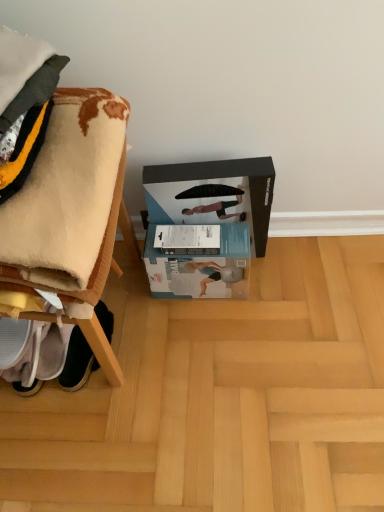
Question: Considering the relative sizes of light brown wood at lower center and white fabric shoe at lower left in the image provided, is light brown wood at lower center bigger than white fabric shoe at lower left?

Choices:
 (A) yes
 (B) no

Answer: (A)

Question: Is light brown wood at lower center shorter than white fabric shoe at lower left?

Choices:
 (A) no
 (B) yes

Answer: (B)

Question: Is light brown wood at lower center facing away from white fabric shoe at lower left?

Choices:
 (A) yes
 (B) no

Answer: (B)

Question: From the image's perspective, is light brown wood at lower center located beneath white fabric shoe at lower left?

Choices:
 (A) no
 (B) yes

Answer: (B)

Question: Is light brown wood at lower center taller than white fabric shoe at lower left?

Choices:
 (A) yes
 (B) no

Answer: (B)

Question: Is light brown wood at lower center closer to the viewer compared to white fabric shoe at lower left?

Choices:
 (A) no
 (B) yes

Answer: (B)

Question: Is white soft blanket at left oriented towards white fabric shoe at lower left?

Choices:
 (A) yes
 (B) no

Answer: (B)

Question: From a real-world perspective, is white soft blanket at left on top of white fabric shoe at lower left?

Choices:
 (A) yes
 (B) no

Answer: (A)

Question: Is white soft blanket at left positioned before white fabric shoe at lower left?

Choices:
 (A) no
 (B) yes

Answer: (B)

Question: Can you confirm if white soft blanket at left is smaller than white fabric shoe at lower left?

Choices:
 (A) yes
 (B) no

Answer: (B)

Question: Is white soft blanket at left next to white fabric shoe at lower left and touching it?

Choices:
 (A) no
 (B) yes

Answer: (A)

Question: Is white soft blanket at left shorter than white fabric shoe at lower left?

Choices:
 (A) no
 (B) yes

Answer: (A)

Question: Is light brown wood at lower center placed right next to white soft blanket at left?

Choices:
 (A) no
 (B) yes

Answer: (A)